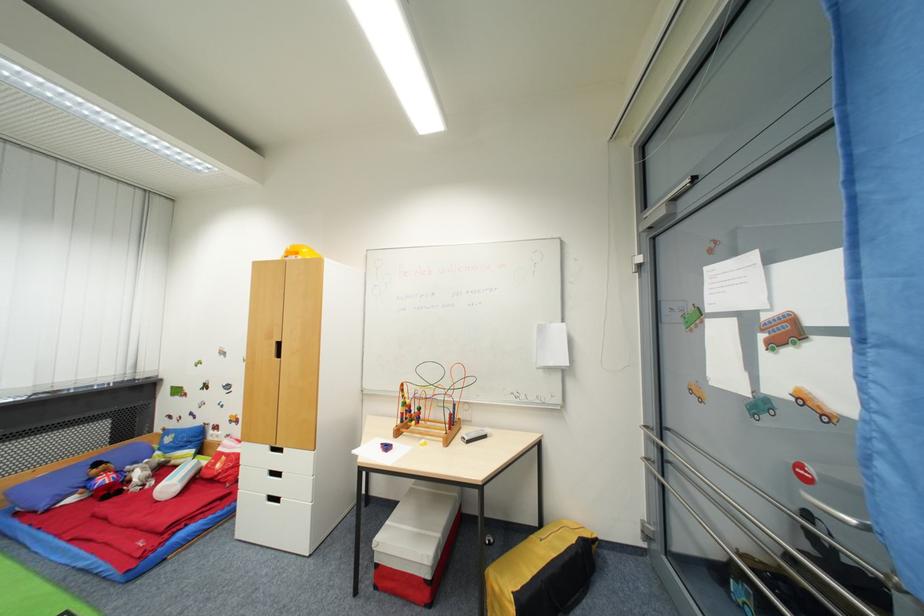
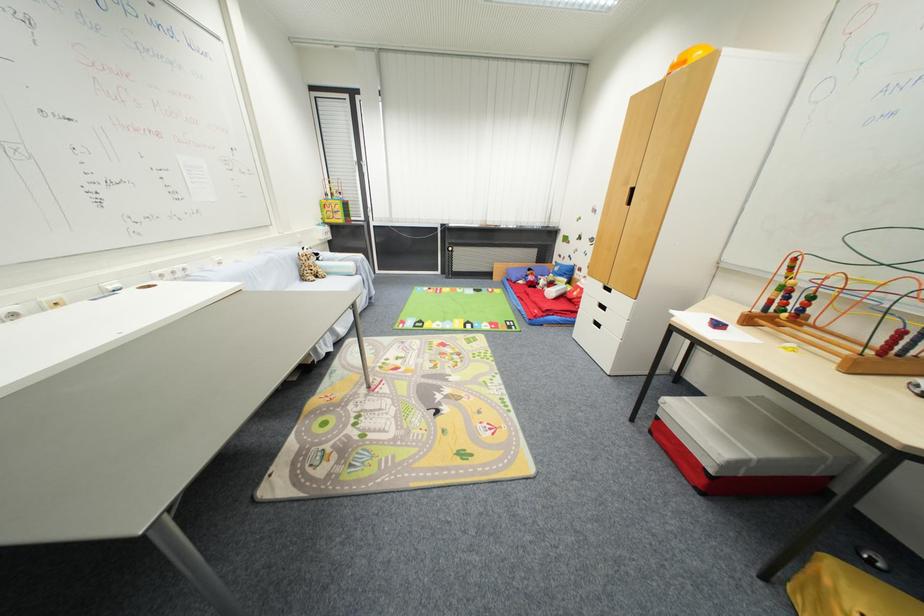
Locate, in the second image, the point that corresponds to point 271,501 in the first image.

(598, 323)